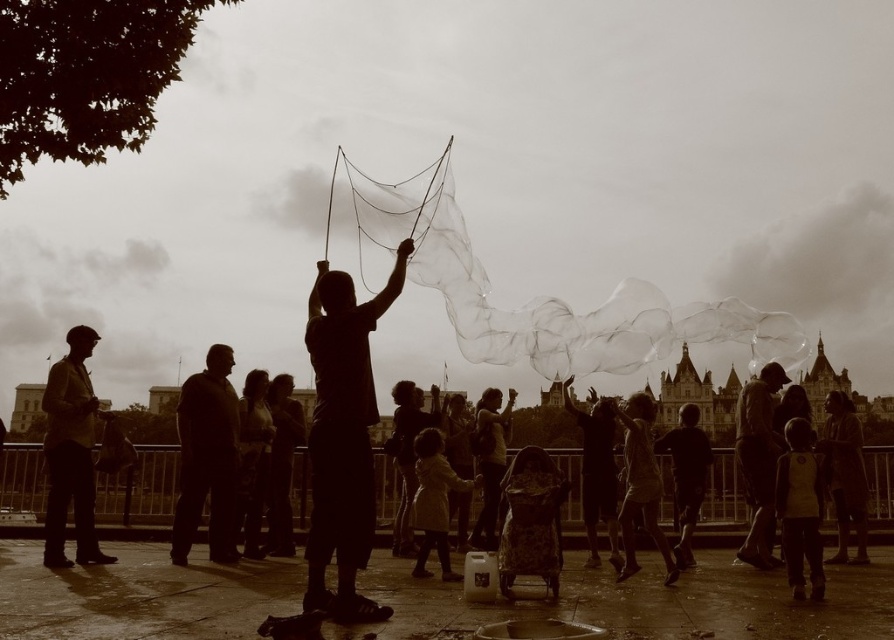
Is matte brown jacket at left to the left of matte white dress at center from the viewer's perspective?

Indeed, matte brown jacket at left is positioned on the left side of matte white dress at center.

The width and height of the screenshot is (894, 640). Find the location of `matte brown jacket at left`. matte brown jacket at left is located at coordinates (72, 452).

Consider the image. Between light yellow fabric shirt at lower right and light beige coat at center, which one appears on the right side from the viewer's perspective?

light yellow fabric shirt at lower right is more to the right.

Image resolution: width=894 pixels, height=640 pixels. Find the location of `light yellow fabric shirt at lower right`. light yellow fabric shirt at lower right is located at coordinates (799, 509).

Who is more distant from viewer, (812, 525) or (417, 556)?

The point (417, 556) is more distant.

This screenshot has height=640, width=894. In order to click on light yellow fabric shirt at lower right in this screenshot , I will do `click(799, 509)`.

Which of these two, matte black shirt at center or light beige coat at center, stands taller?

With more height is matte black shirt at center.

Is the position of matte black shirt at center less distant than that of light beige coat at center?

Yes, matte black shirt at center is closer to the viewer.

Locate an element on the screen. matte black shirt at center is located at coordinates (343, 436).

Where is `matte black shirt at center`? matte black shirt at center is located at coordinates (343, 436).